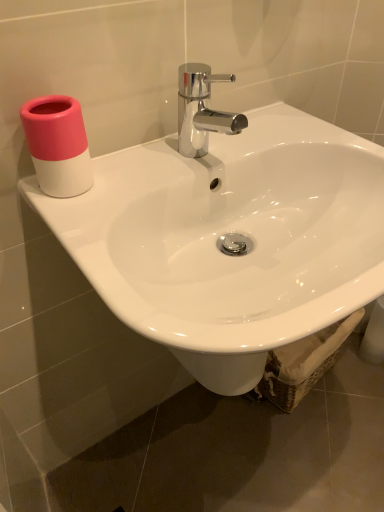
Identify the location of vacant area located to the right-hand side of pink matte cup at upper left. (147, 172).